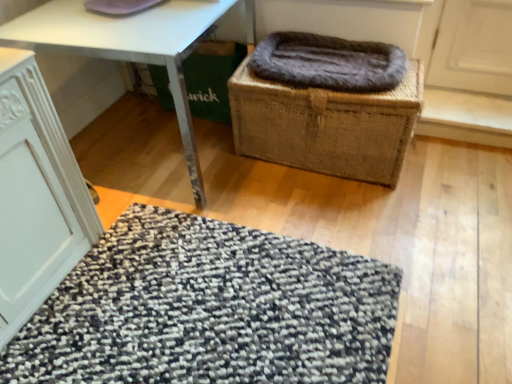
Question: Can we say woven brown basket at center lies outside textured gray mat at lower center?

Choices:
 (A) no
 (B) yes

Answer: (B)

Question: Does woven brown basket at center have a smaller size compared to textured gray mat at lower center?

Choices:
 (A) yes
 (B) no

Answer: (B)

Question: Is woven brown basket at center far away from textured gray mat at lower center?

Choices:
 (A) yes
 (B) no

Answer: (B)

Question: Is woven brown basket at center taller than textured gray mat at lower center?

Choices:
 (A) no
 (B) yes

Answer: (B)

Question: Can you confirm if woven brown basket at center is bigger than textured gray mat at lower center?

Choices:
 (A) no
 (B) yes

Answer: (B)

Question: Based on their positions, is textured gray mat at lower center located to the left or right of white glossy table at center?

Choices:
 (A) left
 (B) right

Answer: (B)

Question: Is point (387, 362) positioned closer to the camera than point (143, 56)?

Choices:
 (A) closer
 (B) farther

Answer: (A)

Question: From a real-world perspective, is textured gray mat at lower center physically located above or below white glossy table at center?

Choices:
 (A) below
 (B) above

Answer: (A)

Question: From the image's perspective, is textured gray mat at lower center located above or below white glossy table at center?

Choices:
 (A) above
 (B) below

Answer: (B)

Question: Considering the relative positions of woven brown basket at center and white glossy table at center in the image provided, is woven brown basket at center to the left or to the right of white glossy table at center?

Choices:
 (A) left
 (B) right

Answer: (B)

Question: Do you think woven brown basket at center is within white glossy table at center, or outside of it?

Choices:
 (A) outside
 (B) inside

Answer: (A)

Question: Considering the positions of point (266, 140) and point (217, 8), is point (266, 140) closer or farther from the camera than point (217, 8)?

Choices:
 (A) closer
 (B) farther

Answer: (B)

Question: From their relative heights in the image, would you say woven brown basket at center is taller or shorter than white glossy table at center?

Choices:
 (A) tall
 (B) short

Answer: (B)

Question: Is woven brown basket at center situated inside textured gray mat at lower center or outside?

Choices:
 (A) outside
 (B) inside

Answer: (A)

Question: From the image's perspective, relative to textured gray mat at lower center, is woven brown basket at center above or below?

Choices:
 (A) above
 (B) below

Answer: (A)